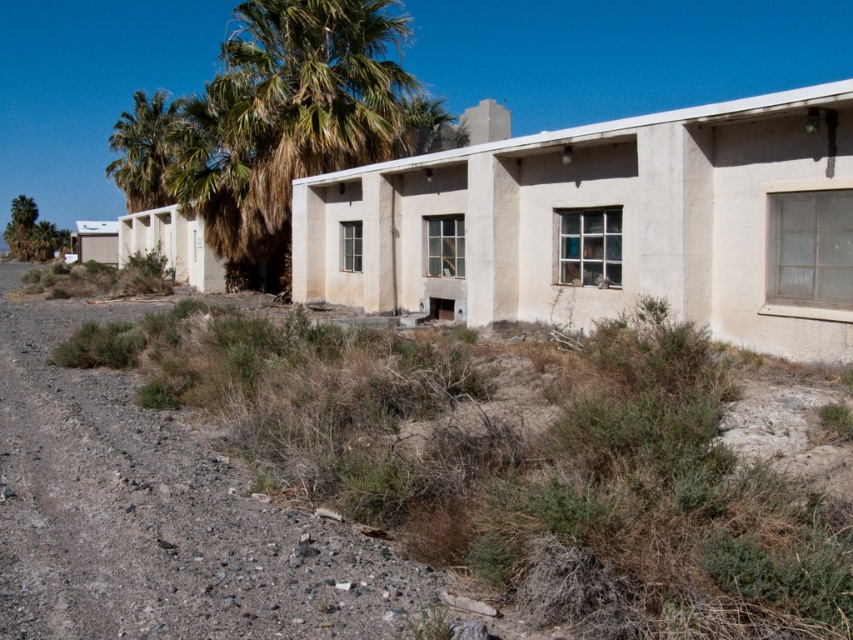
Can you confirm if dusty gravel path at lower left is positioned below green leafy palm tree at upper left?

Yes, dusty gravel path at lower left is below green leafy palm tree at upper left.

Does point (45, 544) come in front of point (161, 150)?

Yes, it is.

Does point (30, 461) lie in front of point (140, 163)?

Yes.

Identify the location of dusty gravel path at lower left. Image resolution: width=853 pixels, height=640 pixels. (160, 513).